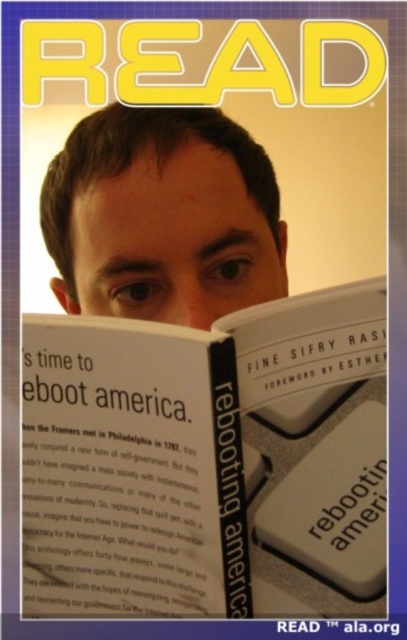
Question: Can you confirm if white paper book at center is smaller than matte skin at center?

Choices:
 (A) yes
 (B) no

Answer: (A)

Question: Observing the image, what is the correct spatial positioning of white paper book at center in reference to matte skin at center?

Choices:
 (A) left
 (B) right

Answer: (B)

Question: Among these objects, which one is farthest from the camera?

Choices:
 (A) white paper book at center
 (B) matte skin at center

Answer: (B)

Question: Is white paper book at center below matte skin at center?

Choices:
 (A) yes
 (B) no

Answer: (A)

Question: Among these points, which one is farthest from the camera?

Choices:
 (A) (140, 317)
 (B) (352, 496)

Answer: (A)